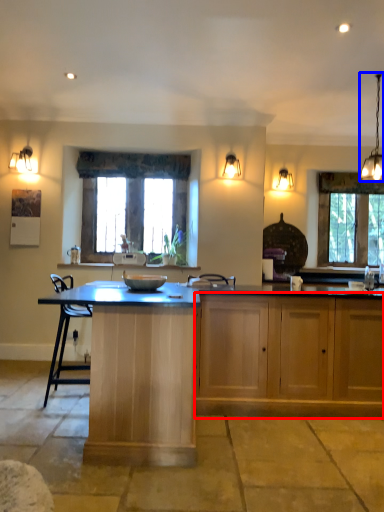
Question: Which of the following is the farthest to the observer, cabinetry (highlighted by a red box) or light fixture (highlighted by a blue box)?

Choices:
 (A) cabinetry
 (B) light fixture

Answer: (B)